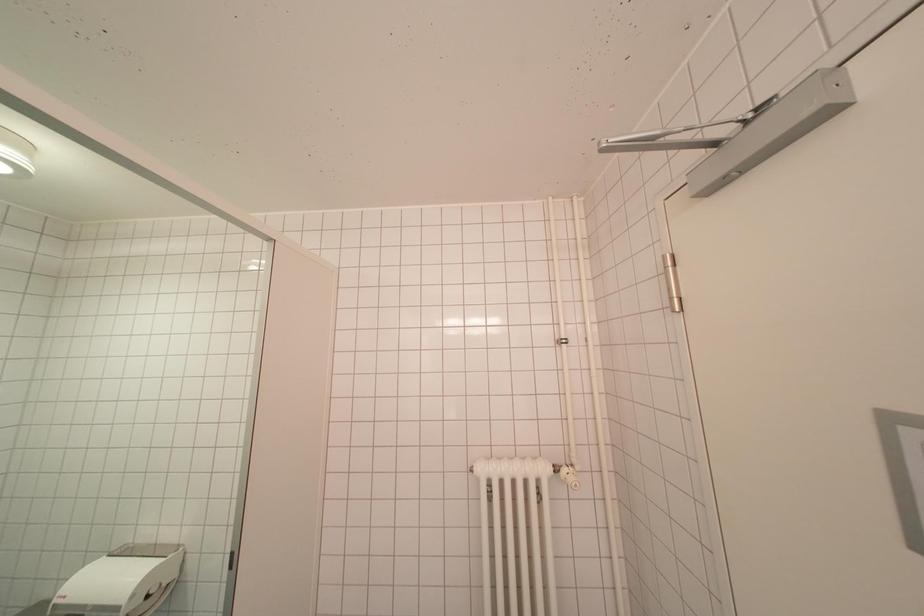
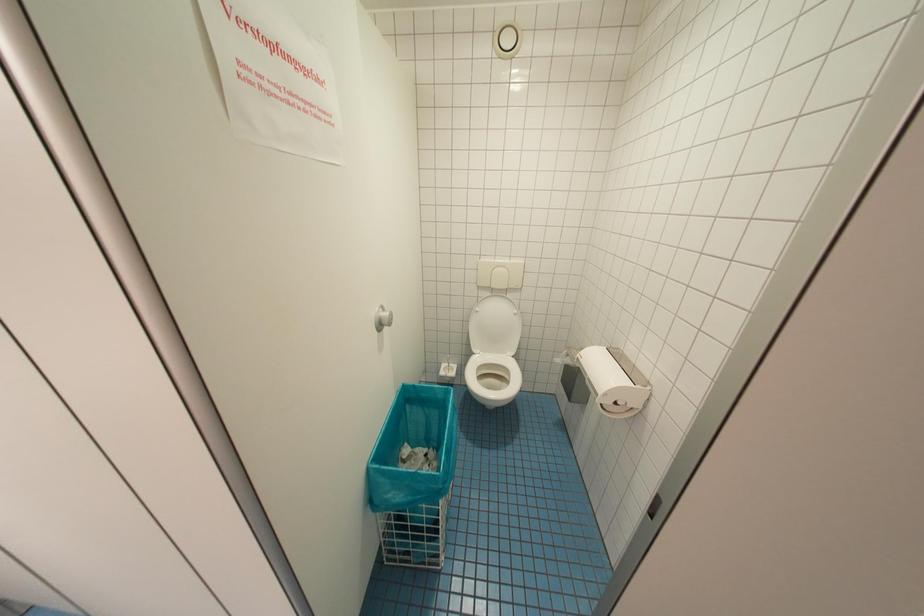
First-person continuous shooting, in which direction is the camera rotating?

The camera rotated toward left-down.